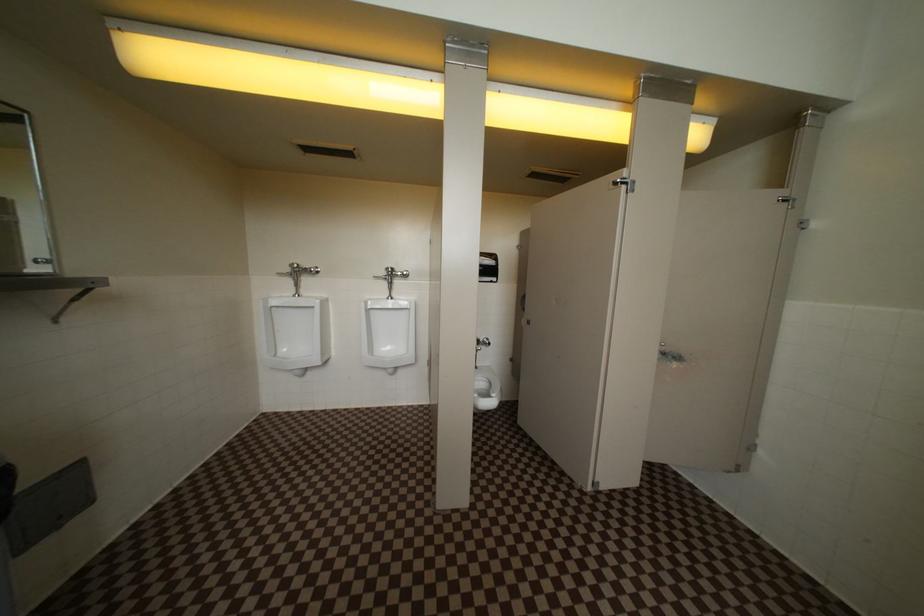
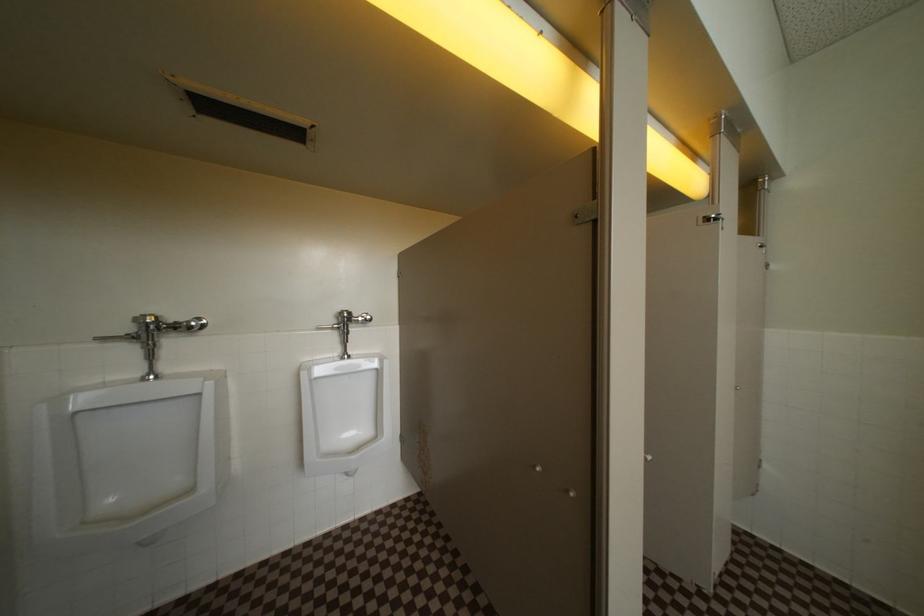
The images are taken continuously from a first-person perspective. In which direction are you moving?

The cameraman walked toward left, forward.